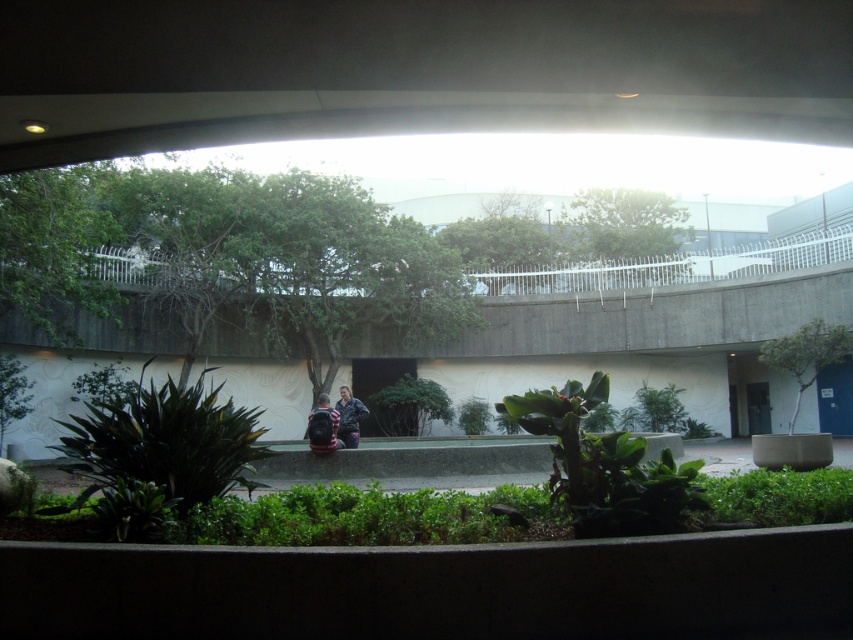
Does dark green leafy plant at center appear on the right side of green leafy tree at upper center?

No, dark green leafy plant at center is not to the right of green leafy tree at upper center.

Based on the photo, which is above, dark green leafy plant at center or green leafy tree at upper center?

green leafy tree at upper center is higher up.

This screenshot has height=640, width=853. Describe the element at coordinates (160, 451) in the screenshot. I see `dark green leafy plant at center` at that location.

The height and width of the screenshot is (640, 853). Find the location of `dark green leafy plant at center`. dark green leafy plant at center is located at coordinates (160, 451).

Which is above, green leafy tree at upper center or dark blue backpack at center?

green leafy tree at upper center is above.

From the picture: Is green leafy tree at upper center bigger than dark blue backpack at center?

Indeed, green leafy tree at upper center has a larger size compared to dark blue backpack at center.

Between point (654, 228) and point (325, 435), which one is positioned behind?

Point (654, 228)

The image size is (853, 640). In order to click on green leafy tree at upper center in this screenshot , I will do `click(624, 225)`.

Who is more distant from viewer, [663,224] or [804,340]?

The point [663,224] is more distant.

This screenshot has height=640, width=853. What do you see at coordinates (624, 225) in the screenshot?
I see `green leafy tree at upper center` at bounding box center [624, 225].

Describe the element at coordinates (624, 225) in the screenshot. I see `green leafy tree at upper center` at that location.

You are a GUI agent. You are given a task and a screenshot of the screen. Output one action in this format:
    pyautogui.click(x=<x>, y=<y>)
    Task: Click on the green leafy tree at upper center
    The height and width of the screenshot is (640, 853).
    Given the screenshot: What is the action you would take?
    pyautogui.click(x=624, y=225)